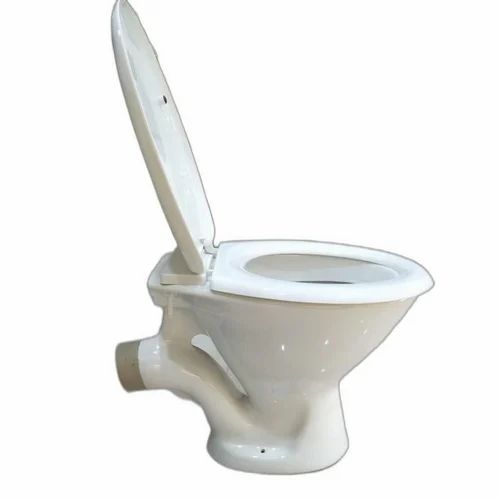
The width and height of the screenshot is (500, 500). I want to click on toilet seat lid, so [175, 138].